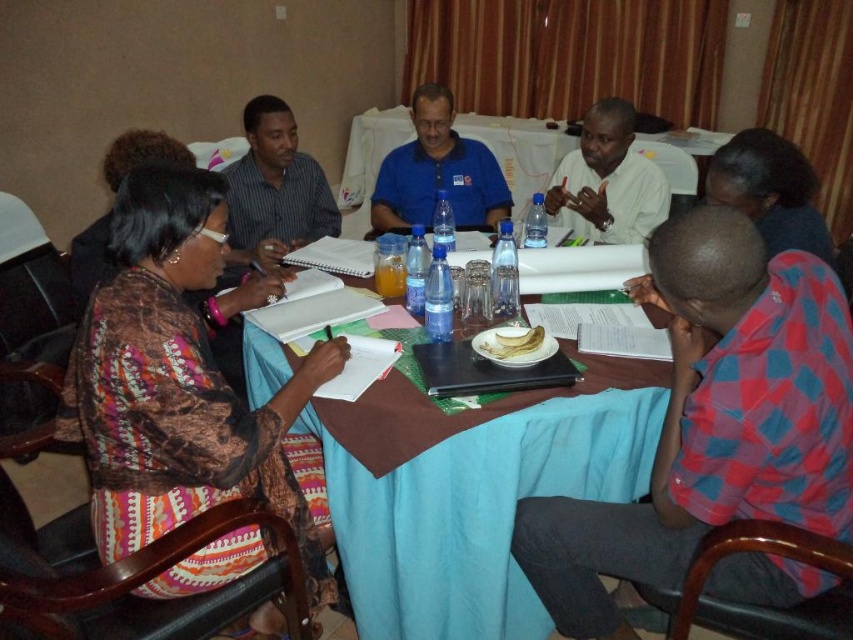
Is blue fabric table at center thinner than white shirt at upper center?

In fact, blue fabric table at center might be wider than white shirt at upper center.

Which is behind, point (410, 422) or point (570, 164)?

The point (570, 164) is more distant.

Find the location of `blue fabric table at center`. blue fabric table at center is located at coordinates (473, 492).

Does red checkered shirt at lower right have a smaller size compared to blue cotton shirt at center?

No.

Who is more forward, (x=718, y=497) or (x=459, y=173)?

Positioned in front is point (x=718, y=497).

The image size is (853, 640). What are the coordinates of `red checkered shirt at lower right` in the screenshot? It's located at (712, 422).

Which is more to the left, blue plastic table at center or white shirt at upper center?

Positioned to the left is blue plastic table at center.

Is blue plastic table at center smaller than white shirt at upper center?

No, blue plastic table at center is not smaller than white shirt at upper center.

What do you see at coordinates (519, 150) in the screenshot?
I see `blue plastic table at center` at bounding box center [519, 150].

Identify the location of blue plastic table at center. This screenshot has width=853, height=640. (519, 150).